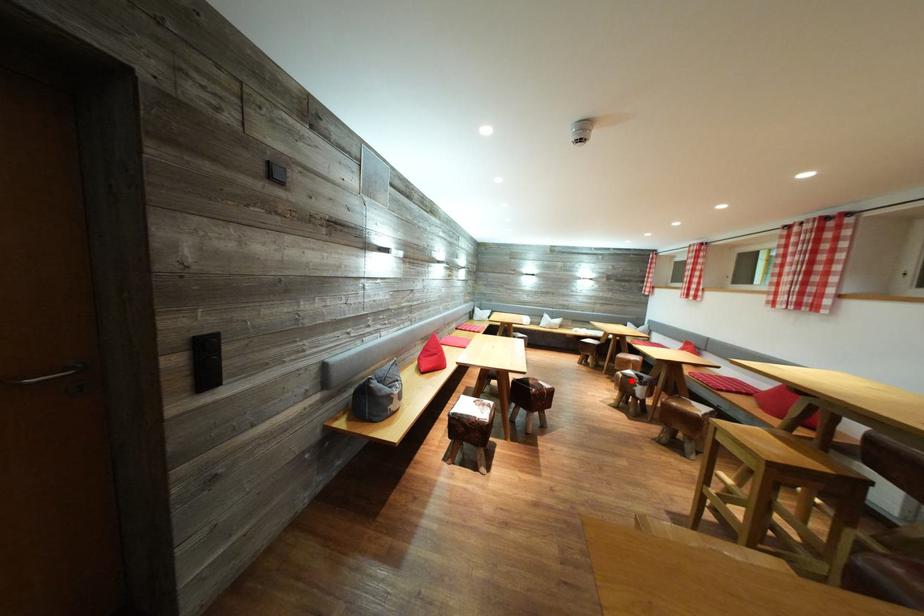
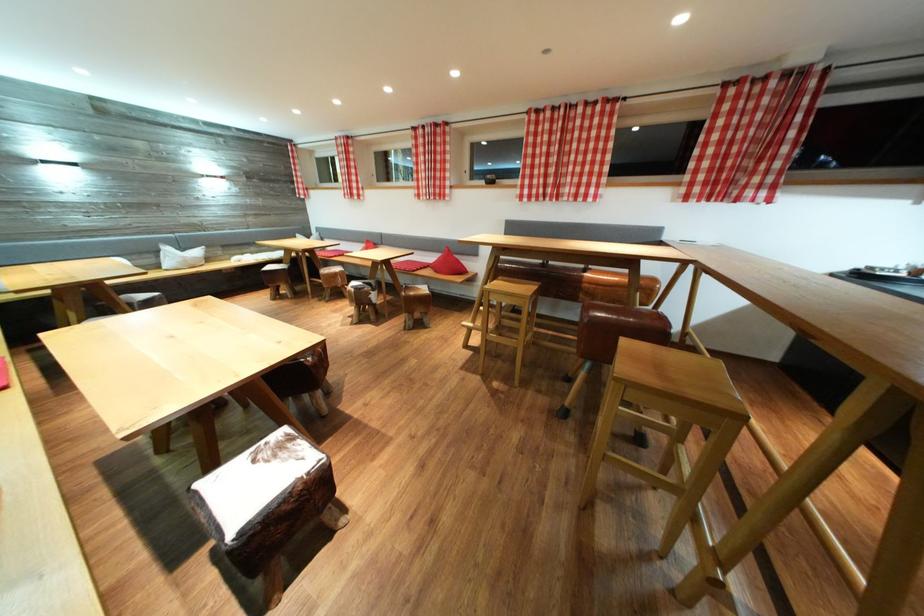
Find the pixel in the second image that matches the highlighted location in the first image.

(362, 294)